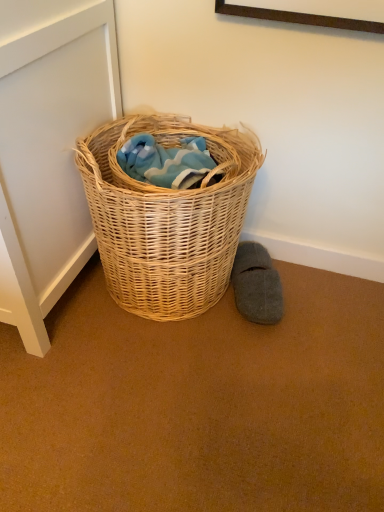
Question: Is woven natural basket at center to the left or to the right of gray felt slipper at lower right in the image?

Choices:
 (A) right
 (B) left

Answer: (B)

Question: Is point (172, 124) positioned closer to the camera than point (278, 285)?

Choices:
 (A) farther
 (B) closer

Answer: (A)

Question: In terms of height, does woven natural basket at center look taller or shorter compared to gray felt slipper at lower right?

Choices:
 (A) short
 (B) tall

Answer: (B)

Question: In terms of size, does gray felt slipper at lower right appear bigger or smaller than woven natural basket at center?

Choices:
 (A) small
 (B) big

Answer: (A)

Question: From a real-world perspective, is gray felt slipper at lower right above or below woven natural basket at center?

Choices:
 (A) below
 (B) above

Answer: (A)

Question: Considering the positions of gray felt slipper at lower right and woven natural basket at center in the image, is gray felt slipper at lower right wider or thinner than woven natural basket at center?

Choices:
 (A) wide
 (B) thin

Answer: (B)

Question: Relative to woven natural basket at center, is gray felt slipper at lower right in front or behind?

Choices:
 (A) behind
 (B) front

Answer: (A)